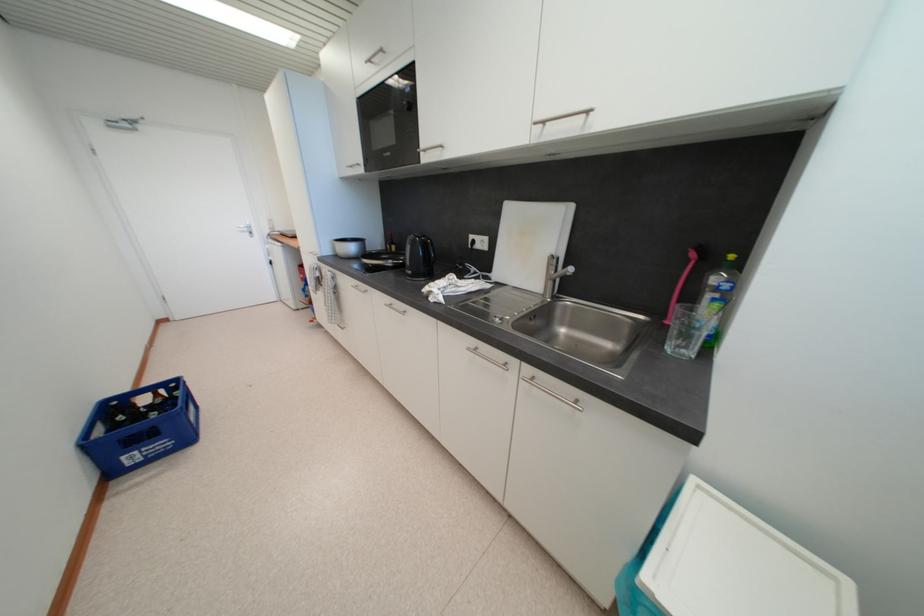
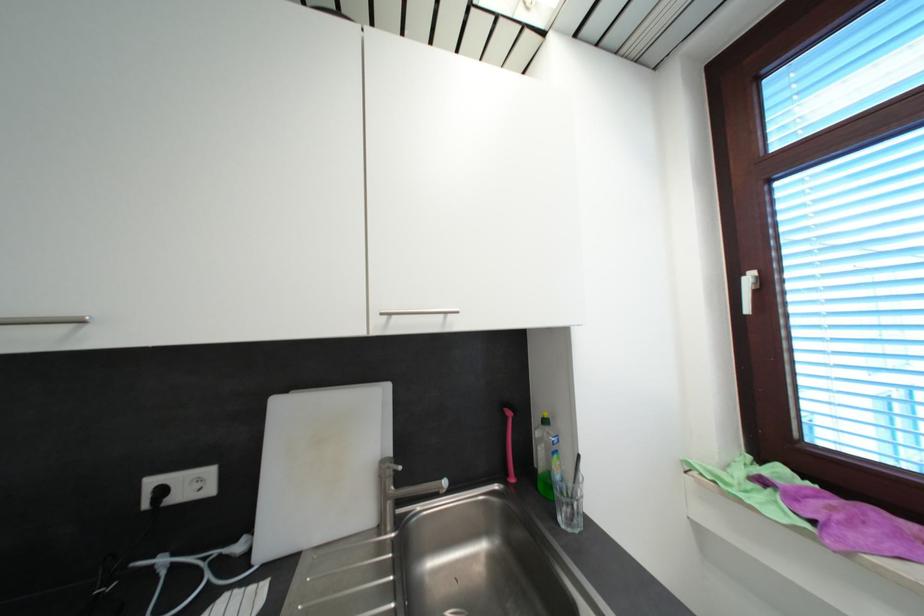
In the second image, find the point that corresponds to point (721, 283) in the first image.

(542, 436)